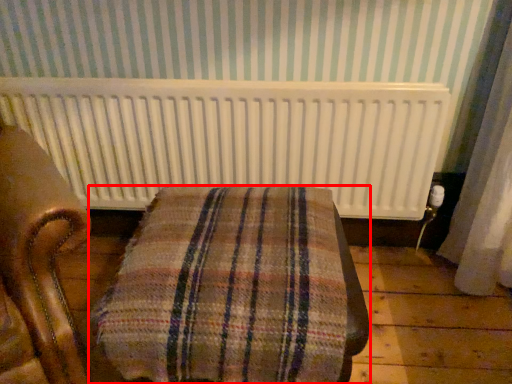
Question: From the image's perspective, where is furniture (annotated by the red box) located relative to radiator?

Choices:
 (A) below
 (B) above

Answer: (A)